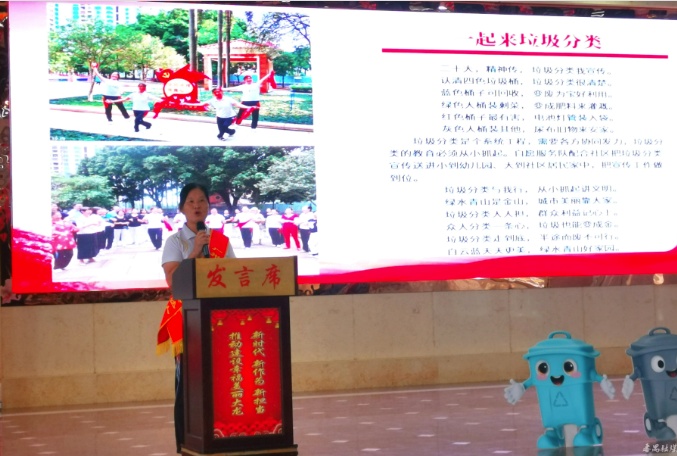
The width and height of the screenshot is (677, 456). I want to click on blue plastic cartoon trash can, so click(554, 360).